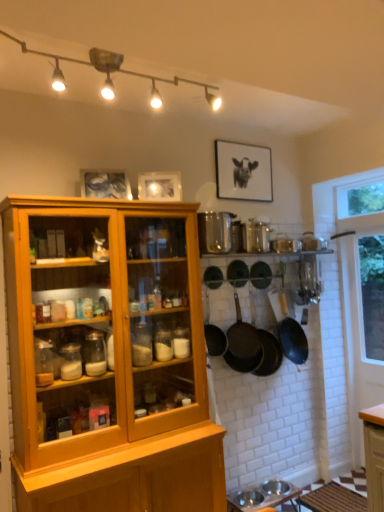
Question: Considering the positions of point (228, 167) and point (377, 320), is point (228, 167) closer or farther from the camera than point (377, 320)?

Choices:
 (A) farther
 (B) closer

Answer: (B)

Question: From the image's perspective, is black matte picture frame at upper center, which is counted as the 1th picture frame, starting from the right, positioned above or below white glass window at right?

Choices:
 (A) below
 (B) above

Answer: (B)

Question: Which is farther from the matte white track lights at upper center?

Choices:
 (A) metallic silver picture frame at upper center, which is counted as the 3th picture frame, starting from the back
 (B) white glass window at right
 (C) black matte frying pan at center, marked as the 5th frying pan in a right-to-left arrangement
 (D) black matte picture frame at upper center, which is counted as the 1th picture frame, starting from the right
 (E) brown woven mat at lower right, the 1th table in the right-to-left sequence

Answer: (E)

Question: Which object is positioned closest to the black matte picture frame at upper center, which is counted as the 1th picture frame, starting from the right?

Choices:
 (A) white glass window at right
 (B) dark brown textured frying pan at center, the 3th frying pan when ordered from right to left
 (C) matte white track lights at upper center
 (D) metallic silver bowls at lower center, which is the 1th table from left to right
 (E) green matte frying pan at center, the 2th frying pan positioned from the right

Answer: (C)